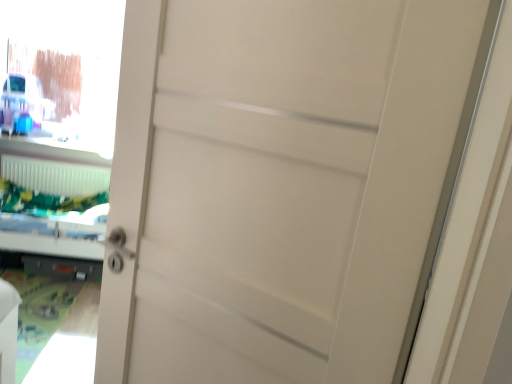
Question: Can you confirm if white plastic radiator at lower left is taller than transparent glass window screen at upper left?

Choices:
 (A) yes
 (B) no

Answer: (B)

Question: Does white plastic radiator at lower left have a larger size compared to transparent glass window screen at upper left?

Choices:
 (A) no
 (B) yes

Answer: (A)

Question: From the image's perspective, would you say white plastic radiator at lower left is positioned over transparent glass window screen at upper left?

Choices:
 (A) yes
 (B) no

Answer: (B)

Question: Is white plastic radiator at lower left positioned with its back to transparent glass window screen at upper left?

Choices:
 (A) no
 (B) yes

Answer: (A)

Question: Is white plastic radiator at lower left positioned beyond the bounds of transparent glass window screen at upper left?

Choices:
 (A) no
 (B) yes

Answer: (B)

Question: Is white plastic radiator at lower left closer to camera compared to transparent glass window screen at upper left?

Choices:
 (A) yes
 (B) no

Answer: (B)

Question: Is the depth of transparent glass window screen at upper left greater than that of white plastic radiator at lower left?

Choices:
 (A) no
 (B) yes

Answer: (A)

Question: Can you confirm if transparent glass window screen at upper left is bigger than white plastic radiator at lower left?

Choices:
 (A) no
 (B) yes

Answer: (B)

Question: Does transparent glass window screen at upper left come in front of white plastic radiator at lower left?

Choices:
 (A) yes
 (B) no

Answer: (A)

Question: Does transparent glass window screen at upper left appear on the left side of white plastic radiator at lower left?

Choices:
 (A) no
 (B) yes

Answer: (A)

Question: Does transparent glass window screen at upper left have a lesser width compared to white plastic radiator at lower left?

Choices:
 (A) no
 (B) yes

Answer: (B)

Question: From a real-world perspective, is transparent glass window screen at upper left positioned under white plastic radiator at lower left based on gravity?

Choices:
 (A) yes
 (B) no

Answer: (B)

Question: Can you confirm if white plastic radiator at lower left is bigger than green fabric bed at left?

Choices:
 (A) no
 (B) yes

Answer: (A)